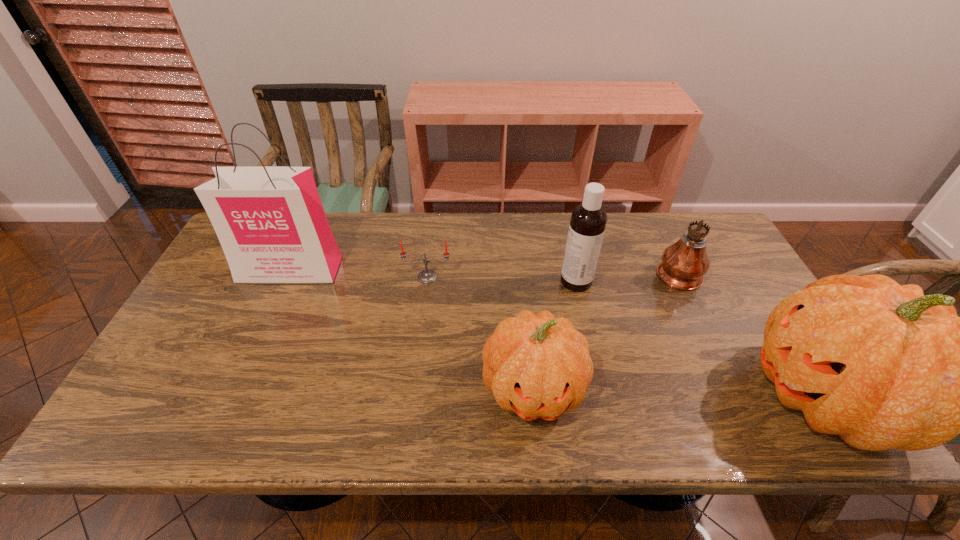
The width and height of the screenshot is (960, 540). I want to click on empty space that is in between the oil lamp and the fifth object from right to left, so click(x=552, y=274).

Choose which object is the second nearest neighbor to the oil lamp. Please provide its 2D coordinates. Your answer should be formatted as a tuple, i.e. [(x, y)], where the tuple contains the x and y coordinates of a point satisfying the conditions above.

[(588, 221)]

Select which object appears as the fourth closest to the right pumpkin. Please provide its 2D coordinates. Your answer should be formatted as a tuple, i.e. [(x, y)], where the tuple contains the x and y coordinates of a point satisfying the conditions above.

[(426, 276)]

The height and width of the screenshot is (540, 960). I want to click on blank space that satisfies the following two spatial constraints: 1. on the front-facing side of the shopping bag; 2. on the left side of the oil lamp, so click(x=289, y=272).